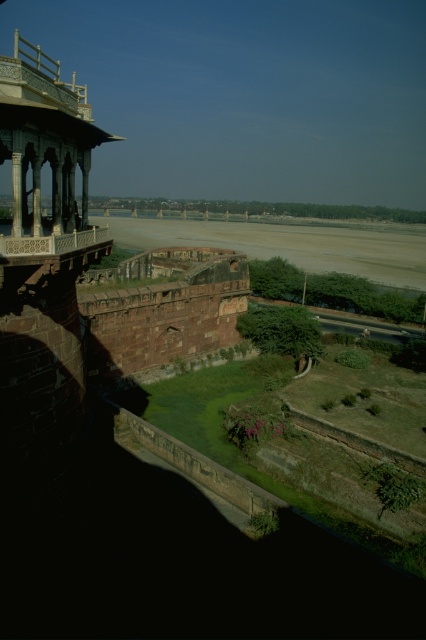
Between white marble gazebo at upper left and smooth stone balcony at upper left, which one appears on the left side from the viewer's perspective?

white marble gazebo at upper left is more to the left.

Which of these two, white marble gazebo at upper left or smooth stone balcony at upper left, stands shorter?

Standing shorter between the two is smooth stone balcony at upper left.

Find the location of a particular element. The width and height of the screenshot is (426, 640). white marble gazebo at upper left is located at coordinates (45, 150).

Is reddish-brown stone wall at center further to camera compared to white marble gazebo at upper left?

Yes, it is.

Who is shorter, reddish-brown stone wall at center or white marble gazebo at upper left?

With less height is reddish-brown stone wall at center.

Is point (89, 296) farther from viewer compared to point (63, 182)?

Yes, it is.

This screenshot has width=426, height=640. What are the coordinates of `reddish-brown stone wall at center` in the screenshot? It's located at (163, 307).

Which is below, reddish-brown stone wall at center or smooth stone balcony at upper left?

reddish-brown stone wall at center is below.

Does reddish-brown stone wall at center have a lesser height compared to smooth stone balcony at upper left?

In fact, reddish-brown stone wall at center may be taller than smooth stone balcony at upper left.

Is point (183, 326) positioned behind point (51, 246)?

Yes.

The width and height of the screenshot is (426, 640). In order to click on reddish-brown stone wall at center in this screenshot , I will do `click(163, 307)`.